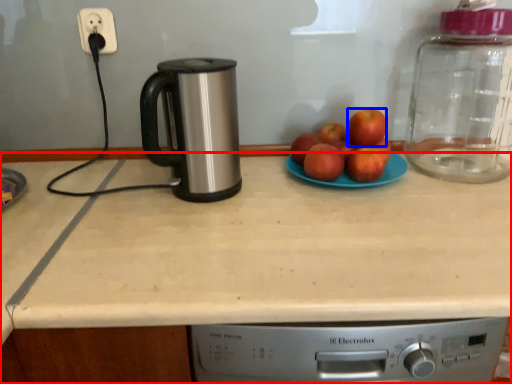
Question: Which object is closer to the camera taking this photo, countertop (highlighted by a red box) or apple (highlighted by a blue box)?

Choices:
 (A) countertop
 (B) apple

Answer: (A)